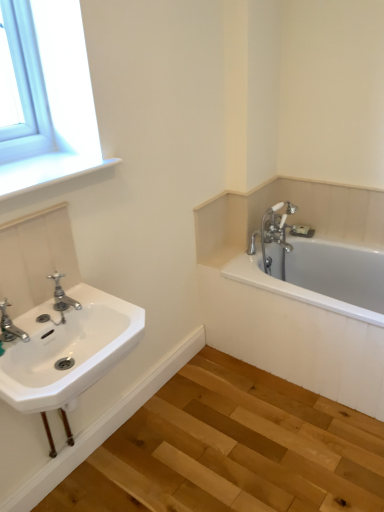
Question: Based on their sizes in the image, would you say white porcelain sink at left is bigger or smaller than white smooth window sill at upper left?

Choices:
 (A) big
 (B) small

Answer: (A)

Question: From the image's perspective, is white porcelain sink at left positioned above or below white smooth window sill at upper left?

Choices:
 (A) above
 (B) below

Answer: (B)

Question: Which object is the closest to the white porcelain sink at left?

Choices:
 (A) brushed metal faucet at lower left, acting as the 2th tap starting from the back
 (B) polished chrome faucet at left, the first tap from the right
 (C) white smooth window sill at upper left
 (D) white ceramic bathtub at right

Answer: (A)

Question: Considering the real-world distances, which object is farthest from the polished chrome faucet at left, the first tap from the right?

Choices:
 (A) brushed metal faucet at lower left, the first tap in the left-to-right sequence
 (B) white smooth window sill at upper left
 (C) white porcelain sink at left
 (D) white ceramic bathtub at right

Answer: (D)